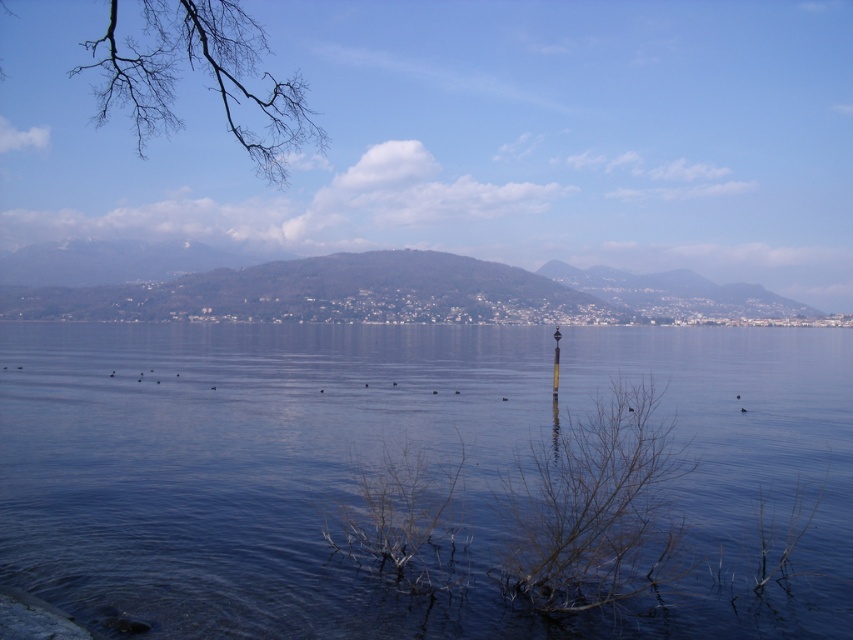
Is bare branches at center to the left of bare branches at upper left from the viewer's perspective?

No, bare branches at center is not to the left of bare branches at upper left.

Can you confirm if bare branches at center is bigger than bare branches at upper left?

Actually, bare branches at center might be smaller than bare branches at upper left.

Between point (631, 387) and point (236, 1), which one is positioned in front?

Positioned in front is point (631, 387).

You are a GUI agent. You are given a task and a screenshot of the screen. Output one action in this format:
    pyautogui.click(x=<x>, y=<y>)
    Task: Click on the bare branches at center
    This screenshot has width=853, height=640.
    Given the screenshot: What is the action you would take?
    pyautogui.click(x=595, y=508)

How far apart are green grassy hill at center and bare branches at upper left?

green grassy hill at center and bare branches at upper left are 51.61 meters apart.

Can you confirm if green grassy hill at center is positioned below bare branches at upper left?

Correct, green grassy hill at center is located below bare branches at upper left.

In order to click on green grassy hill at center in this screenshot , I will do `click(358, 289)`.

Is green grassy hill at center behind bare branches at center?

Yes, green grassy hill at center is further from the viewer.

Between green grassy hill at center and bare branches at center, which one appears on the left side from the viewer's perspective?

green grassy hill at center

Does point (569, 284) come farther from viewer compared to point (585, 442)?

Yes.

Where is `green grassy hill at center`? The width and height of the screenshot is (853, 640). green grassy hill at center is located at coordinates (358, 289).